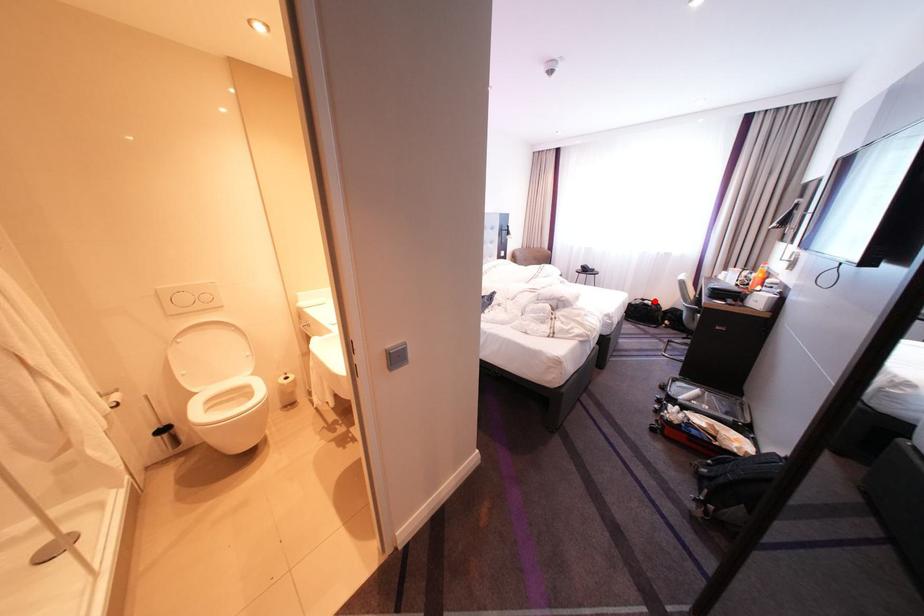
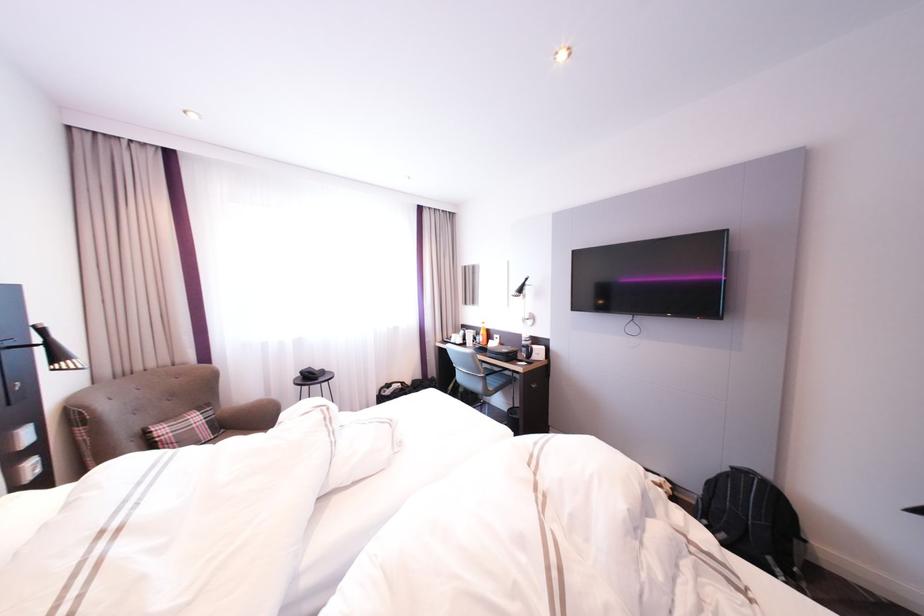
Locate, in the second image, the point that corresponds to the highlighted location in the first image.

(400, 386)